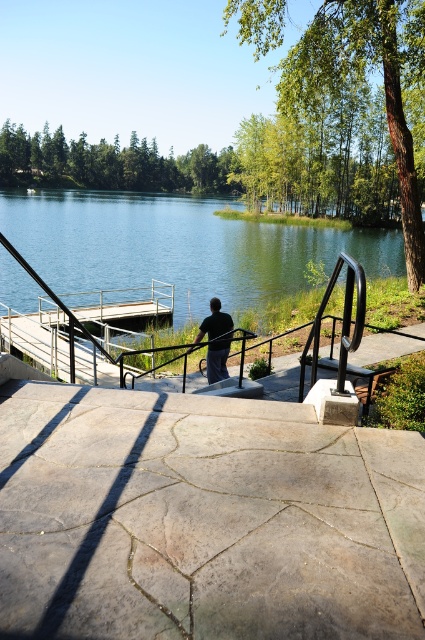
Question: Can you confirm if green water at center is thinner than dark gray fabric pants at center?

Choices:
 (A) no
 (B) yes

Answer: (A)

Question: Where is green water at center located in relation to dark gray fabric pants at center in the image?

Choices:
 (A) above
 (B) below

Answer: (A)

Question: Which of the following is the closest to the observer?

Choices:
 (A) dark gray fabric pants at center
 (B) green water at center

Answer: (A)

Question: Which object appears closest to the camera in this image?

Choices:
 (A) dark gray fabric pants at center
 (B) green water at center

Answer: (A)

Question: Is green water at center to the right of dark gray fabric pants at center from the viewer's perspective?

Choices:
 (A) yes
 (B) no

Answer: (B)